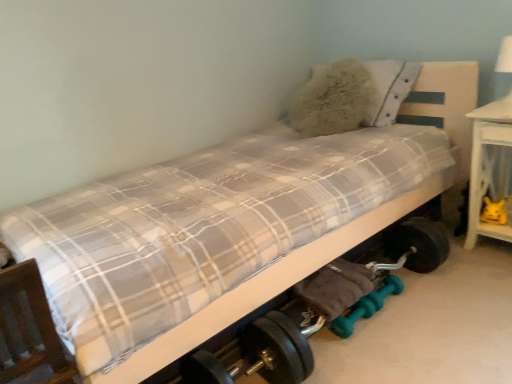
Question: From the image's perspective, is wooden bed frame at lower left positioned above or below fluffy white pillow at upper right?

Choices:
 (A) below
 (B) above

Answer: (A)

Question: From a real-world perspective, is wooden bed frame at lower left above or below fluffy white pillow at upper right?

Choices:
 (A) below
 (B) above

Answer: (A)

Question: Which object is the farthest from the yellow plush toy at lower right?

Choices:
 (A) white glossy table lamp at upper right
 (B) teal rubber dumbbells at lower center
 (C) fluffy white pillow at upper right
 (D) white wood table at right
 (E) wooden bed frame at lower left

Answer: (E)

Question: Estimate the real-world distances between objects in this image. Which object is farther from the white glossy table lamp at upper right?

Choices:
 (A) teal rubber dumbbells at lower center
 (B) yellow plush toy at lower right
 (C) fluffy white pillow at upper right
 (D) wooden bed frame at lower left
 (E) white wood table at right

Answer: (D)